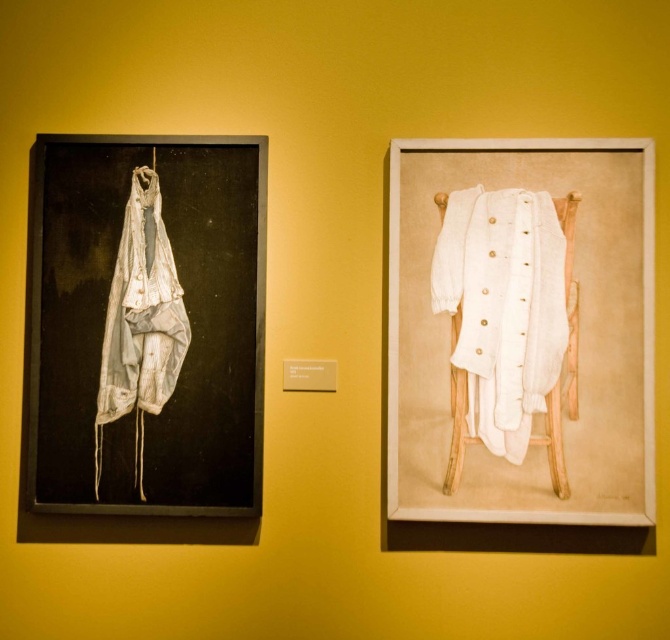
Who is more distant from viewer, (468, 428) or (151, 157)?

The point (151, 157) is behind.

You are a GUI agent. You are given a task and a screenshot of the screen. Output one action in this format:
    pyautogui.click(x=<x>, y=<y>)
    Task: Click on the white cotton robe at center
    The image size is (670, 640).
    Given the screenshot: What is the action you would take?
    pyautogui.click(x=502, y=307)

Identify the location of white fabric pants at left. (145, 324).

This screenshot has width=670, height=640. What are the coordinates of `white fabric pants at left` in the screenshot? It's located at (145, 324).

This screenshot has width=670, height=640. Find the location of `white fabric pants at left`. white fabric pants at left is located at coordinates (145, 324).

Who is higher up, white cotton coat at right or white tattered cloth at left?

white cotton coat at right is higher up.

Can you confirm if white cotton coat at right is positioned above white tattered cloth at left?

Indeed, white cotton coat at right is positioned over white tattered cloth at left.

Does point (643, 173) come in front of point (109, 397)?

Yes, it is in front of point (109, 397).

Locate an element on the screen. The height and width of the screenshot is (640, 670). white cotton coat at right is located at coordinates (578, 336).